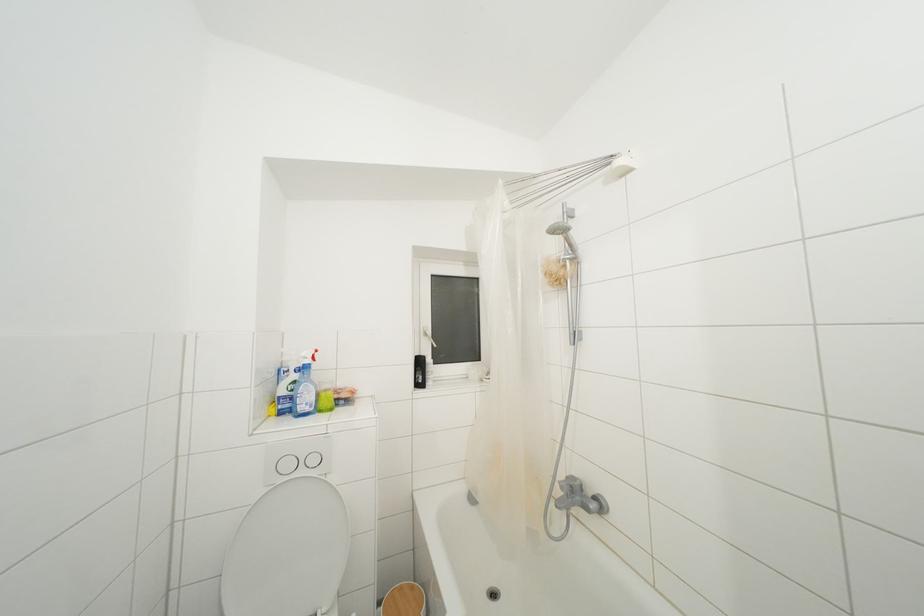
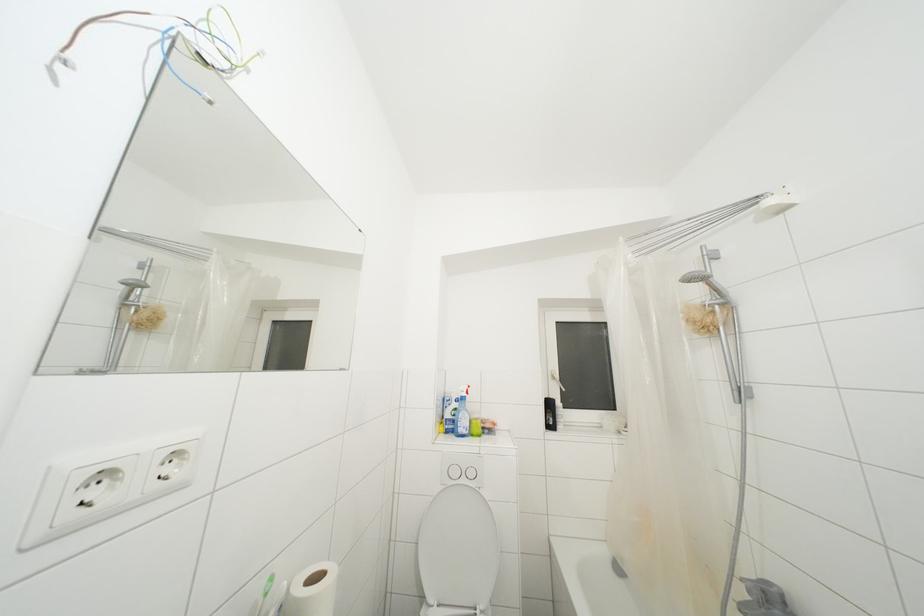
Question: The images are taken continuously from a first-person perspective. In which direction are you moving?

Choices:
 (A) Left
 (B) Right
 (C) Forward
 (D) Backward

Answer: (D)